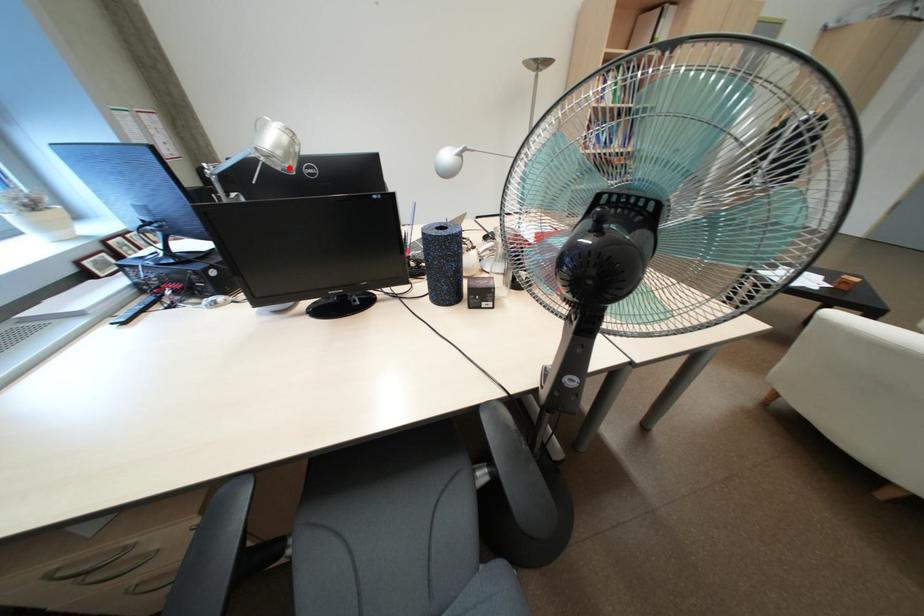
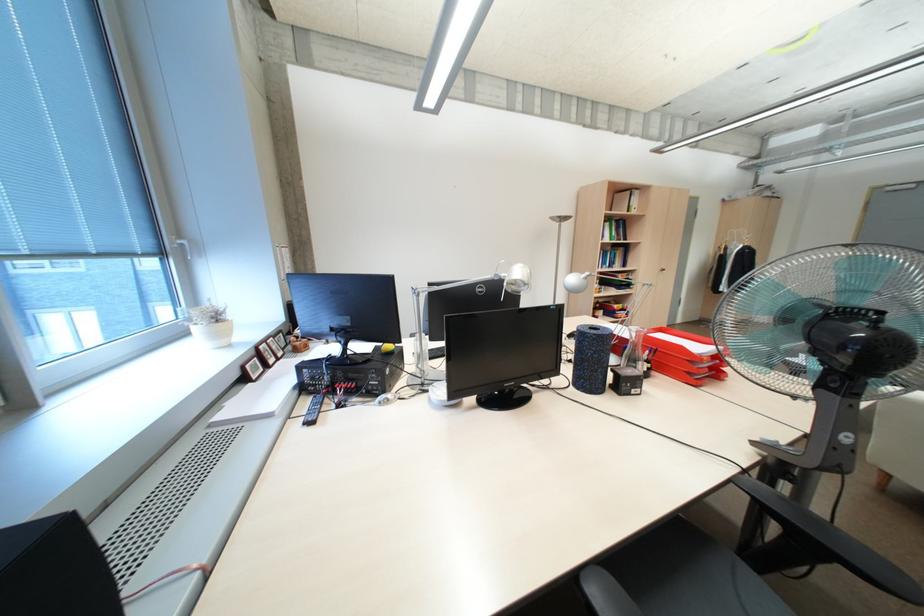
The point at the highlighted location is marked in the first image. Where is the corresponding point in the second image?

(519, 290)